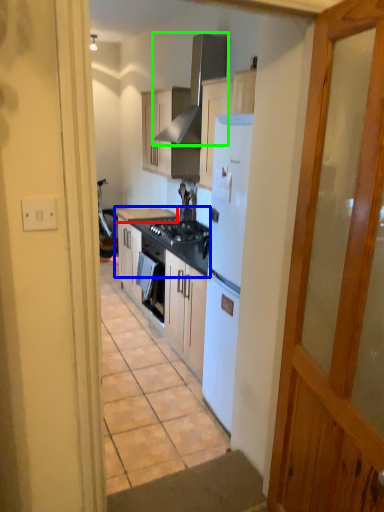
Question: Which is nearer to the countertop (highlighted by a red box)? countertop (highlighted by a blue box) or exhaust hood (highlighted by a green box).

Choices:
 (A) countertop
 (B) exhaust hood

Answer: (A)